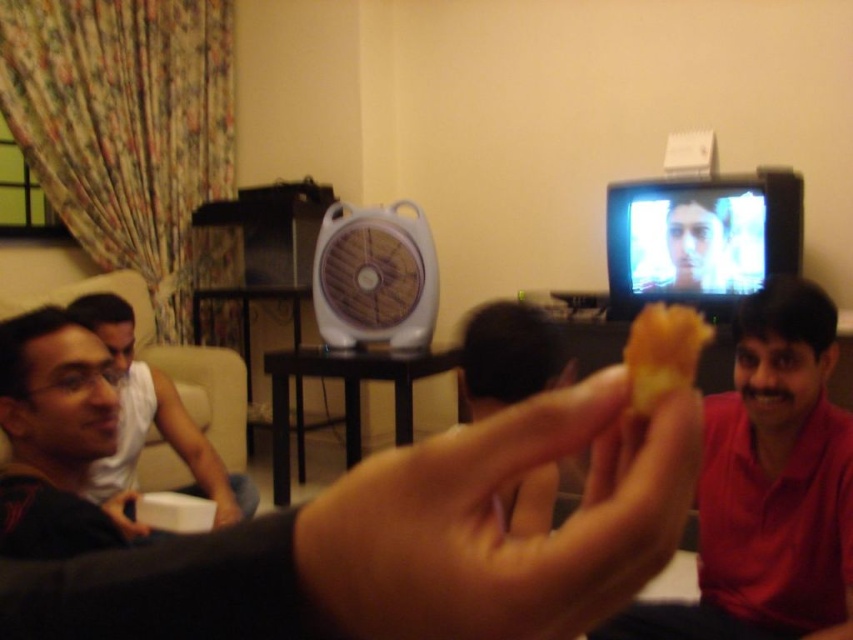
You are at a party and want to grab the skinny yellow bread at center to eat. However, there is a red matte shirt at right in the way. Can you reach the bread without moving the shirt?

The skinny yellow bread at center is closer to the viewer than the red matte shirt at right, so yes, you can reach the bread without moving the shirt since it is in front of the shirt.

You are a photographer who wants to ensure that the red matte shirt at right and the matte black hand at center are both visible in your photo. Given their sizes, which object should you focus on to ensure both are in focus?

The red matte shirt at right is larger in size than the matte black hand at center. To ensure both are in focus, you should focus on the red matte shirt at right since it is larger and might require more detailed sharpness, but adjusting the depth of field to include both would be ideal.

What is located at the point with coordinates (508, 356) in the image?

The point with coordinates (508, 356) is located on brown matte bread at center.